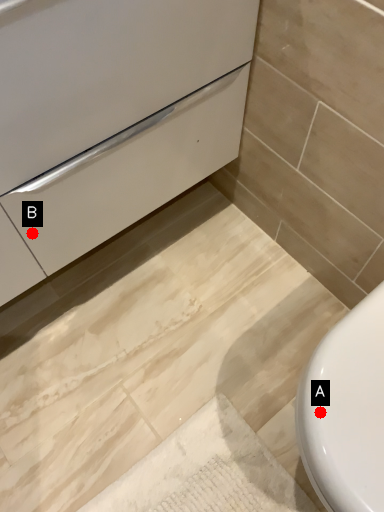
Question: Two points are circled on the image, labeled by A and B beside each circle. Which of the following is the closest to the observer?

Choices:
 (A) A is closer
 (B) B is closer

Answer: (A)